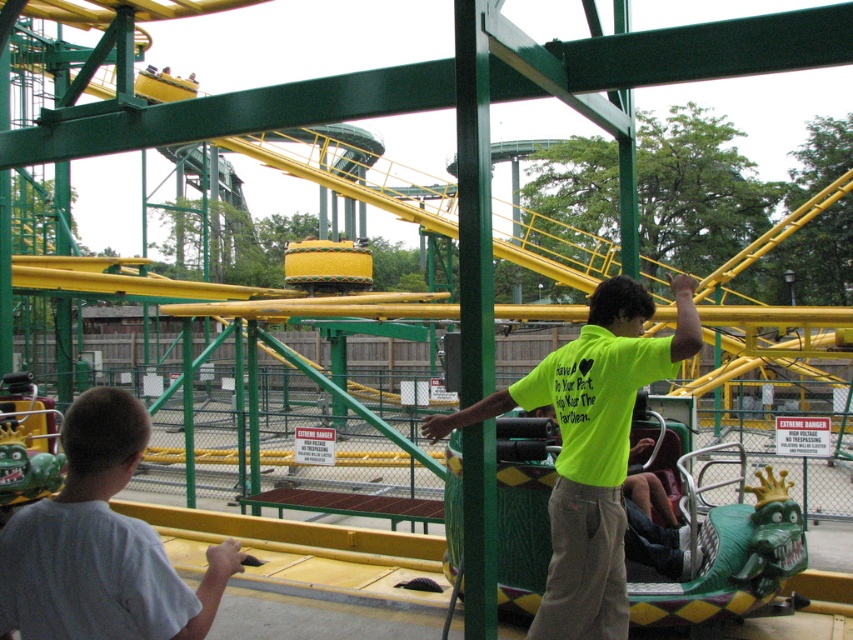
Question: Does neon yellow t-shirt at center have a smaller size compared to white matte shirt at lower left?

Choices:
 (A) yes
 (B) no

Answer: (B)

Question: Which of the following is the closest to the observer?

Choices:
 (A) [x=120, y=436]
 (B) [x=619, y=333]

Answer: (A)

Question: Is neon yellow t-shirt at center bigger than white matte shirt at lower left?

Choices:
 (A) no
 (B) yes

Answer: (B)

Question: From the image, what is the correct spatial relationship of neon yellow t-shirt at center in relation to white matte shirt at lower left?

Choices:
 (A) right
 (B) left

Answer: (A)